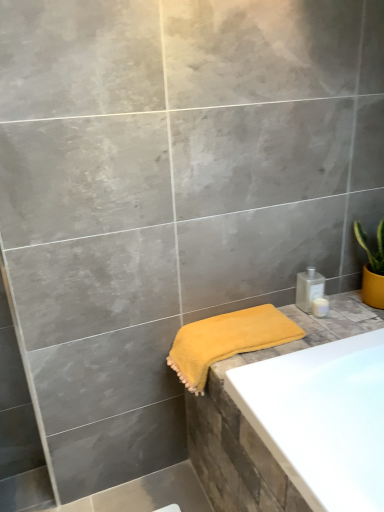
Question: Could you tell me if yellow soft towel at lower right is facing satin silver bottle at right, the 2th toiletry when ordered from bottom to top?

Choices:
 (A) yes
 (B) no

Answer: (B)

Question: Considering the relative positions of yellow soft towel at lower right and satin silver bottle at right, the first toiletry in the top-to-bottom sequence, in the image provided, is yellow soft towel at lower right to the right of satin silver bottle at right, the first toiletry in the top-to-bottom sequence, from the viewer's perspective?

Choices:
 (A) yes
 (B) no

Answer: (B)

Question: From a real-world perspective, does yellow soft towel at lower right stand above satin silver bottle at right, the 2th toiletry when ordered from bottom to top?

Choices:
 (A) yes
 (B) no

Answer: (B)

Question: Is the surface of yellow soft towel at lower right in direct contact with satin silver bottle at right, the 2th toiletry when ordered from bottom to top?

Choices:
 (A) yes
 (B) no

Answer: (B)

Question: Can you confirm if yellow soft towel at lower right is positioned to the left of satin silver bottle at right, the first toiletry in the top-to-bottom sequence?

Choices:
 (A) no
 (B) yes

Answer: (B)

Question: Considering their positions, is yellow soft towel at lower right located in front of or behind satin silver bottle at right, the 2th toiletry when ordered from bottom to top?

Choices:
 (A) behind
 (B) front

Answer: (B)

Question: Looking at their shapes, would you say yellow soft towel at lower right is wider or thinner than satin silver bottle at right, the first toiletry in the top-to-bottom sequence?

Choices:
 (A) thin
 (B) wide

Answer: (B)

Question: Considering the positions of yellow soft towel at lower right and satin silver bottle at right, the first toiletry in the top-to-bottom sequence, in the image, is yellow soft towel at lower right taller or shorter than satin silver bottle at right, the first toiletry in the top-to-bottom sequence,?

Choices:
 (A) short
 (B) tall

Answer: (B)

Question: From a real-world perspective, is yellow soft towel at lower right above or below satin silver bottle at right, the first toiletry in the top-to-bottom sequence?

Choices:
 (A) above
 (B) below

Answer: (B)

Question: From the image's perspective, relative to satin silver bottle at right, the first toiletry in the top-to-bottom sequence, is white glossy soap dispenser at upper right, the first toiletry when ordered from bottom to top, above or below?

Choices:
 (A) above
 (B) below

Answer: (B)

Question: Considering the positions of white glossy soap dispenser at upper right, the second toiletry positioned from the top, and satin silver bottle at right, the first toiletry in the top-to-bottom sequence, in the image, is white glossy soap dispenser at upper right, the second toiletry positioned from the top, wider or thinner than satin silver bottle at right, the first toiletry in the top-to-bottom sequence,?

Choices:
 (A) thin
 (B) wide

Answer: (A)

Question: Is white glossy soap dispenser at upper right, the first toiletry when ordered from bottom to top, spatially inside satin silver bottle at right, the first toiletry in the top-to-bottom sequence, or outside of it?

Choices:
 (A) outside
 (B) inside

Answer: (A)

Question: From a real-world perspective, relative to satin silver bottle at right, the 2th toiletry when ordered from bottom to top, is white glossy soap dispenser at upper right, the first toiletry when ordered from bottom to top, vertically above or below?

Choices:
 (A) below
 (B) above

Answer: (A)

Question: From their relative heights in the image, would you say white glossy soap dispenser at upper right, the second toiletry positioned from the top, is taller or shorter than yellow soft towel at lower right?

Choices:
 (A) short
 (B) tall

Answer: (A)

Question: In terms of size, does white glossy soap dispenser at upper right, the first toiletry when ordered from bottom to top, appear bigger or smaller than yellow soft towel at lower right?

Choices:
 (A) big
 (B) small

Answer: (B)